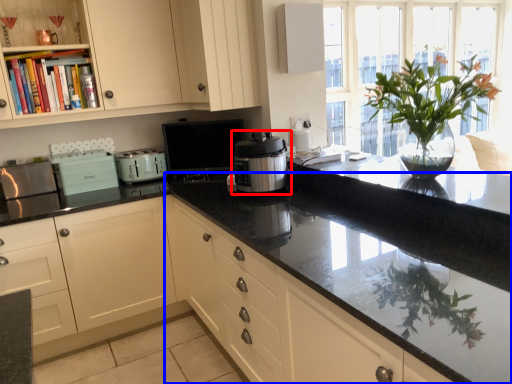
Question: Which object appears farthest to the camera in this image, home appliance (highlighted by a red box) or countertop (highlighted by a blue box)?

Choices:
 (A) home appliance
 (B) countertop

Answer: (A)